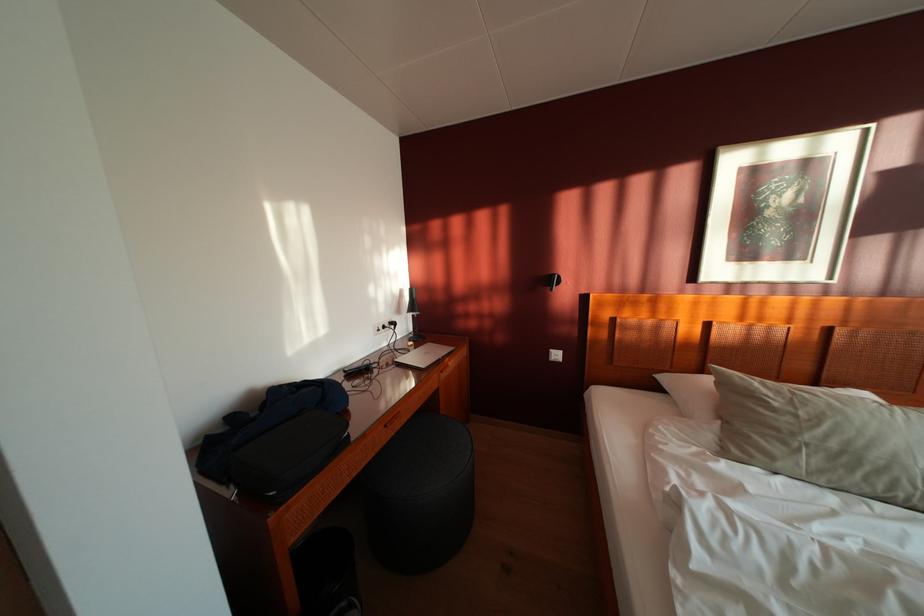
In order to click on white light switch in this screenshot , I will do `click(554, 355)`.